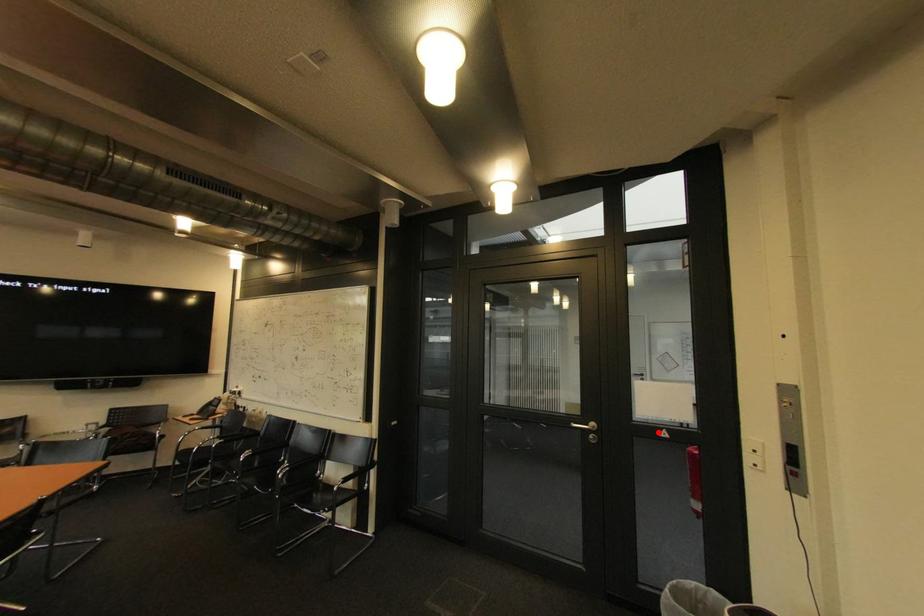
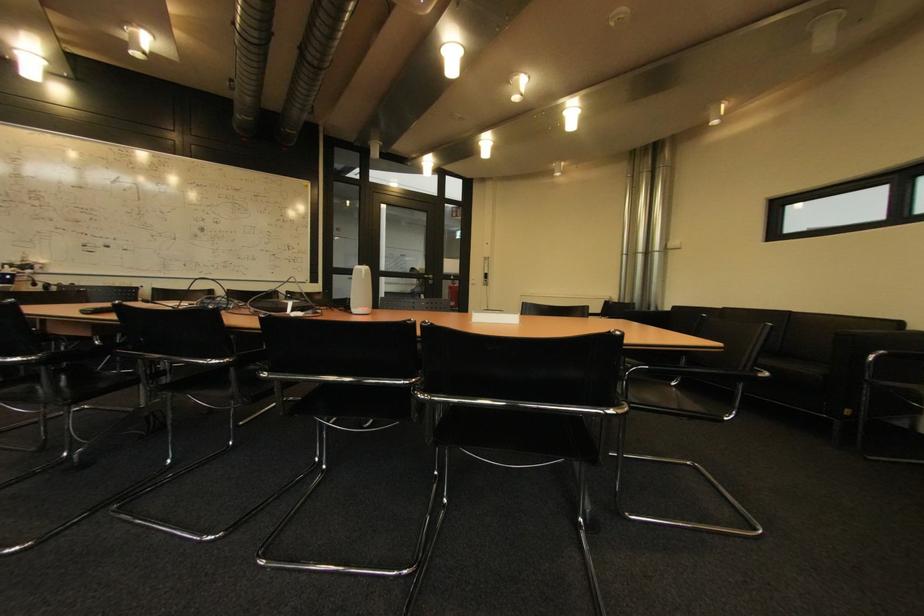
Question: I am providing you with two images of the same scene from different viewpoints. A red point is marked on the first image. Is the red point's position out of view in image 2?

Choices:
 (A) Yes
 (B) No

Answer: (B)